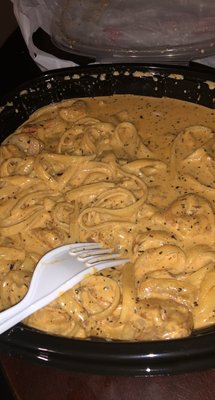
I want to click on fork, so click(x=47, y=287).